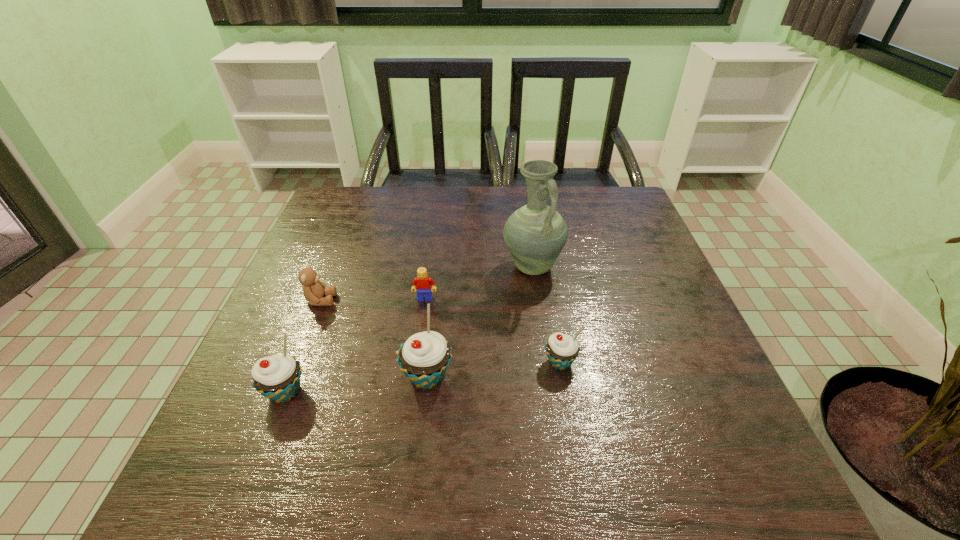
You are a GUI agent. You are given a task and a screenshot of the screen. Output one action in this format:
    pyautogui.click(x=<x>, y=<y>)
    Task: Click on the fourth shortest object
    The width and height of the screenshot is (960, 540).
    Given the screenshot: What is the action you would take?
    pyautogui.click(x=277, y=377)

Find the location of a particular element. This screenshot has height=540, width=960. the second tallest cupcake is located at coordinates (277, 377).

This screenshot has height=540, width=960. What are the coordinates of `the second cupcake from right to left` in the screenshot? It's located at (424, 358).

The height and width of the screenshot is (540, 960). I want to click on the second tallest object, so click(x=424, y=358).

Locate an element on the screen. the shortest cupcake is located at coordinates (562, 349).

The width and height of the screenshot is (960, 540). What are the coordinates of `teddy bear` in the screenshot? It's located at (314, 290).

At what (x,y) coordinates should I click in order to perform the action: click on the tallest object. Please return your answer as a coordinate pair (x, y). This screenshot has height=540, width=960. Looking at the image, I should click on (535, 234).

The image size is (960, 540). Identify the location of pitcher. (535, 234).

This screenshot has height=540, width=960. I want to click on Lego, so click(422, 283).

At what (x,y) coordinates should I click in order to perform the action: click on vacant region located 0.170m on the right of the fourth shortest object. Please return your answer as a coordinate pair (x, y). This screenshot has width=960, height=540. Looking at the image, I should click on (398, 392).